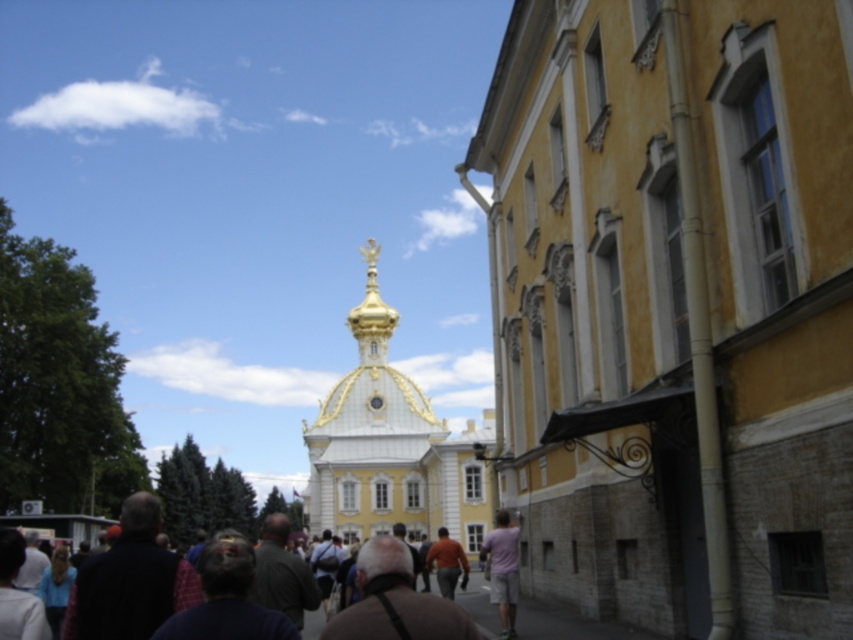
Between gold plated dome at center and orange cotton shirt at center, which one has more height?

With more height is gold plated dome at center.

Is gold plated dome at center positioned at the back of orange cotton shirt at center?

Yes.

At what (x,y) coordinates should I click in order to perform the action: click on gold plated dome at center. Please return your answer as a coordinate pair (x, y). Looking at the image, I should click on (390, 445).

Locate an element on the screen. The height and width of the screenshot is (640, 853). gold plated dome at center is located at coordinates (390, 445).

Does pink cotton shirt at center have a lesser width compared to orange cotton shirt at center?

No.

Which is behind, point (517, 552) or point (440, 572)?

The point (440, 572) is more distant.

This screenshot has height=640, width=853. What do you see at coordinates (503, 570) in the screenshot? I see `pink cotton shirt at center` at bounding box center [503, 570].

What are the coordinates of `pink cotton shirt at center` in the screenshot? It's located at (503, 570).

Does dark brown leather jacket at center have a lesser width compared to orange cotton shirt at center?

No, dark brown leather jacket at center is not thinner than orange cotton shirt at center.

From the picture: Which of these two, dark brown leather jacket at center or orange cotton shirt at center, stands shorter?

Standing shorter between the two is orange cotton shirt at center.

Is point (347, 618) behind point (445, 584)?

No, it is in front of (445, 584).

I want to click on dark brown leather jacket at center, so click(x=432, y=612).